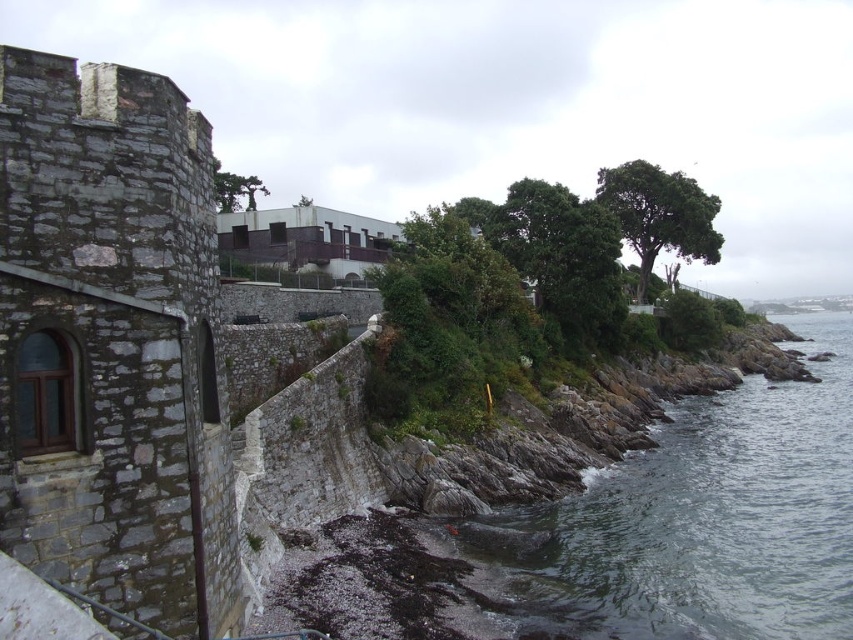
Question: Is gray stone wall at left wider than green leafy tree at upper right?

Choices:
 (A) no
 (B) yes

Answer: (A)

Question: Is the position of gray stone wall at left less distant than that of clear water at lower right?

Choices:
 (A) yes
 (B) no

Answer: (A)

Question: In this image, where is gray stone wall at left located relative to clear water at lower right?

Choices:
 (A) right
 (B) left

Answer: (B)

Question: Among these objects, which one is farthest from the camera?

Choices:
 (A) green matte tree at upper center
 (B) green leafy tree at upper right
 (C) clear water at lower right
 (D) gray stone wall at left

Answer: (B)

Question: Which object appears closest to the camera in this image?

Choices:
 (A) gray stone wall at left
 (B) green matte tree at upper center
 (C) green leafy tree at upper right
 (D) clear water at lower right

Answer: (A)

Question: Which object appears farthest from the camera in this image?

Choices:
 (A) green leafy tree at upper right
 (B) clear water at lower right

Answer: (A)